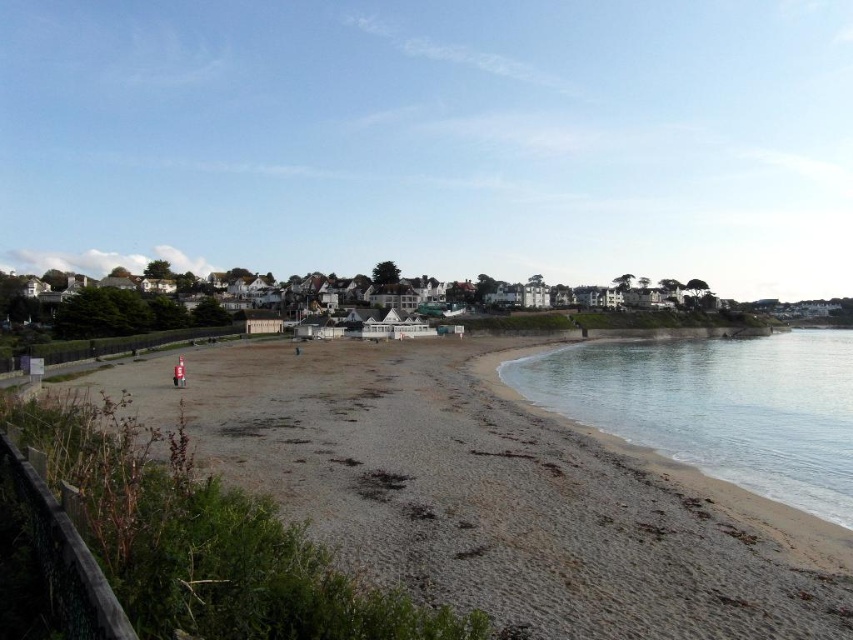
Question: Which object is farther from the camera taking this photo?

Choices:
 (A) gray gravelly sand at lower left
 (B) clear water at beach right

Answer: (B)

Question: Is gray gravelly sand at lower left closer to camera compared to clear water at beach right?

Choices:
 (A) yes
 (B) no

Answer: (A)

Question: Can you confirm if gray gravelly sand at lower left is positioned to the left of clear water at beach right?

Choices:
 (A) yes
 (B) no

Answer: (A)

Question: Is gray gravelly sand at lower left above clear water at beach right?

Choices:
 (A) yes
 (B) no

Answer: (B)